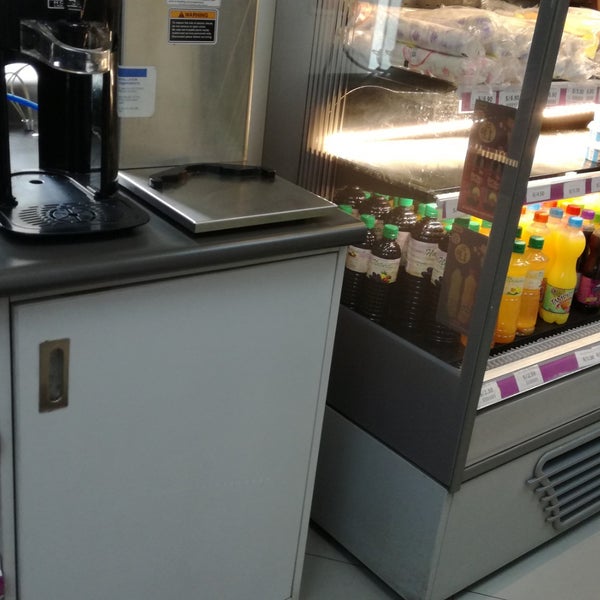
Where is `dark grey counter top`? This screenshot has height=600, width=600. dark grey counter top is located at coordinates (150, 243).